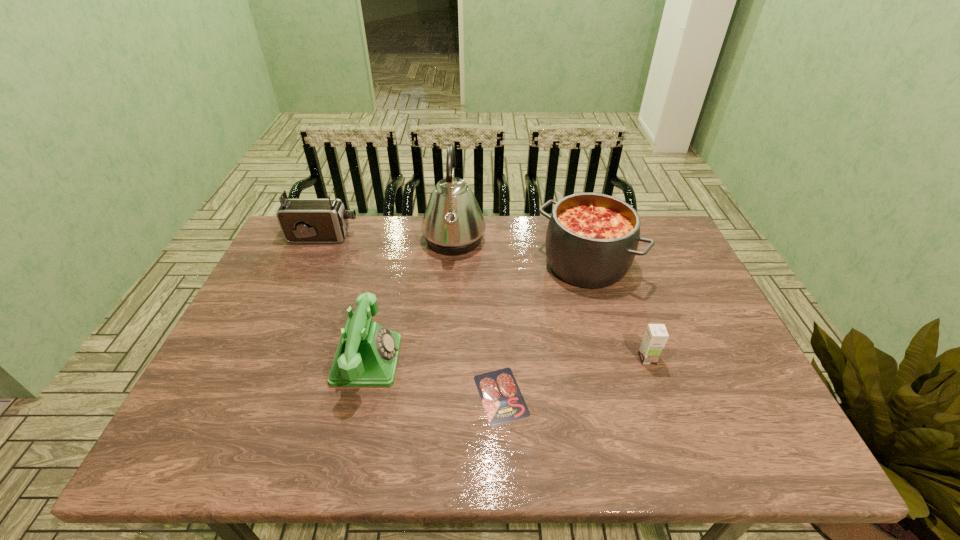
Locate an element on the screen. The height and width of the screenshot is (540, 960). free space between the telephone and the salami is located at coordinates (434, 377).

The height and width of the screenshot is (540, 960). Identify the location of free space between the tallest object and the camcorder. (389, 239).

You are a GUI agent. You are given a task and a screenshot of the screen. Output one action in this format:
    pyautogui.click(x=<x>, y=<y>)
    Task: Click on the unoccupied area between the kettle and the casserole
    Image resolution: width=960 pixels, height=540 pixels.
    Given the screenshot: What is the action you would take?
    pyautogui.click(x=520, y=253)

Locate an element on the screen. The height and width of the screenshot is (540, 960). free space between the casserole and the telephone is located at coordinates pos(477,312).

Identify the location of vacant area that lies between the shortest object and the kettle. This screenshot has width=960, height=540. (478, 318).

Identify the location of object that is the fifth closest to the salami. Image resolution: width=960 pixels, height=540 pixels. (301, 220).

Find the location of a particular element. The height and width of the screenshot is (540, 960). the fifth closest object relative to the shortest object is located at coordinates (301, 220).

Locate an element on the screen. The image size is (960, 540). free space in the image that satisfies the following two spatial constraints: 1. on the dial of the salami; 2. on the right side of the telephone is located at coordinates (359, 395).

You are a GUI agent. You are given a task and a screenshot of the screen. Output one action in this format:
    pyautogui.click(x=<x>, y=<y>)
    Task: Click on the vacant space that satisfies the following two spatial constraints: 1. at the lens of the shortest object; 2. on the right side of the camcorder
    The width and height of the screenshot is (960, 540).
    Given the screenshot: What is the action you would take?
    pyautogui.click(x=253, y=395)

At what (x,y) coordinates should I click in order to perform the action: click on free region that satisfies the following two spatial constraints: 1. from the spout of the kettle; 2. on the right side of the chocolate milk. Please return your answer as a coordinate pair (x, y). Looking at the image, I should click on (445, 359).